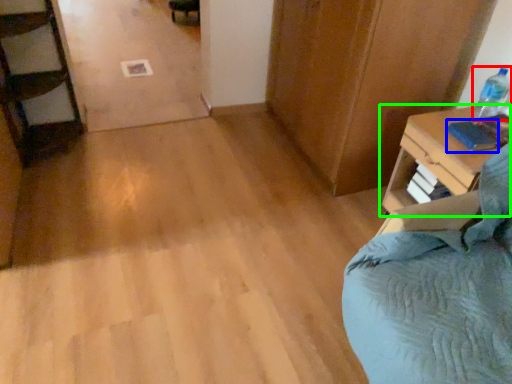
Question: Which object is the farthest from bottle (highlighted by a red box)? Choose among these: book (highlighted by a blue box) or nightstand (highlighted by a green box).

Choices:
 (A) book
 (B) nightstand

Answer: (B)